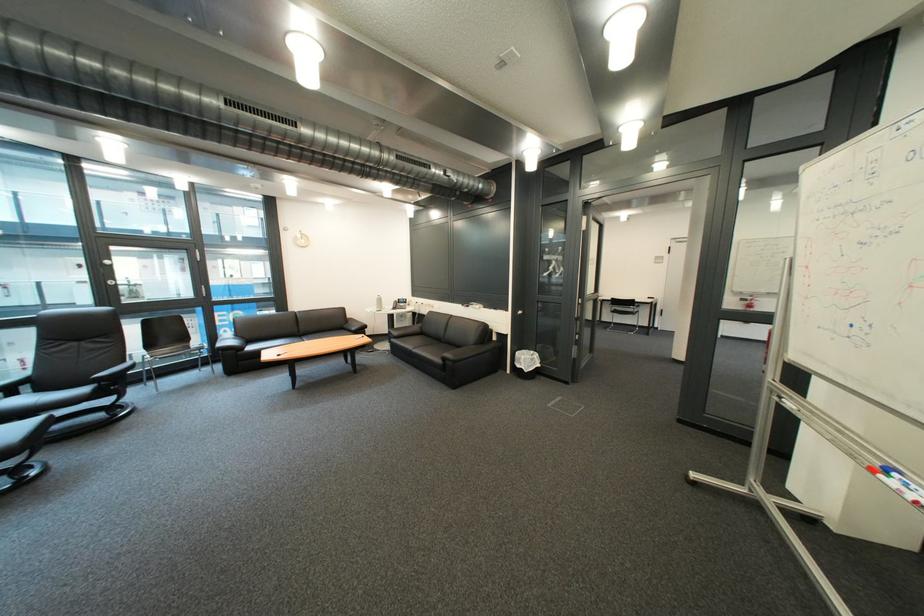
The height and width of the screenshot is (616, 924). Identify the location of silver window handle. (106, 262).